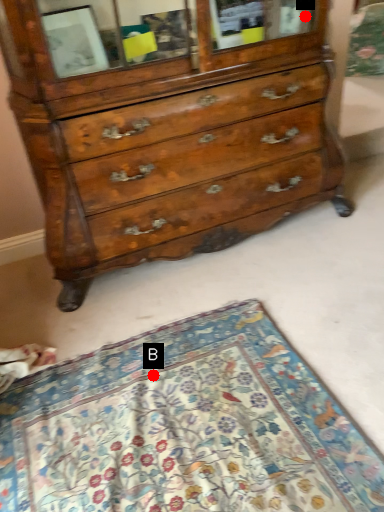
Question: Two points are circled on the image, labeled by A and B beside each circle. Which point is farther from the camera taking this photo?

Choices:
 (A) A is further
 (B) B is further

Answer: (A)